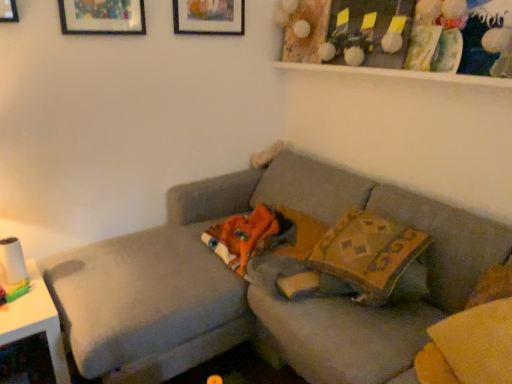
Question: Considering the relative sizes of patterned fabric pillow at center and white glossy table at left in the image provided, is patterned fabric pillow at center thinner than white glossy table at left?

Choices:
 (A) no
 (B) yes

Answer: (B)

Question: Considering the relative positions of patterned fabric pillow at center and white glossy table at left in the image provided, is patterned fabric pillow at center to the left of white glossy table at left from the viewer's perspective?

Choices:
 (A) no
 (B) yes

Answer: (A)

Question: Is patterned fabric pillow at center taller than white glossy table at left?

Choices:
 (A) yes
 (B) no

Answer: (B)

Question: Is patterned fabric pillow at center next to white glossy table at left and touching it?

Choices:
 (A) no
 (B) yes

Answer: (A)

Question: Can you confirm if patterned fabric pillow at center is shorter than white glossy table at left?

Choices:
 (A) no
 (B) yes

Answer: (B)

Question: Is the position of patterned fabric pillow at center more distant than that of white glossy table at left?

Choices:
 (A) yes
 (B) no

Answer: (A)

Question: Is textured gray couch at center surrounding matte wooden picture frame at upper center?

Choices:
 (A) yes
 (B) no

Answer: (B)

Question: Is textured gray couch at center bigger than matte wooden picture frame at upper center?

Choices:
 (A) no
 (B) yes

Answer: (B)

Question: Can you confirm if textured gray couch at center is smaller than matte wooden picture frame at upper center?

Choices:
 (A) no
 (B) yes

Answer: (A)

Question: Is textured gray couch at center thinner than matte wooden picture frame at upper center?

Choices:
 (A) yes
 (B) no

Answer: (B)

Question: Is textured gray couch at center taller than matte wooden picture frame at upper center?

Choices:
 (A) yes
 (B) no

Answer: (A)

Question: From a real-world perspective, is textured gray couch at center positioned over matte wooden picture frame at upper center based on gravity?

Choices:
 (A) yes
 (B) no

Answer: (B)

Question: Is matte wooden picture frame at upper center thinner than textured gray couch at center?

Choices:
 (A) no
 (B) yes

Answer: (B)